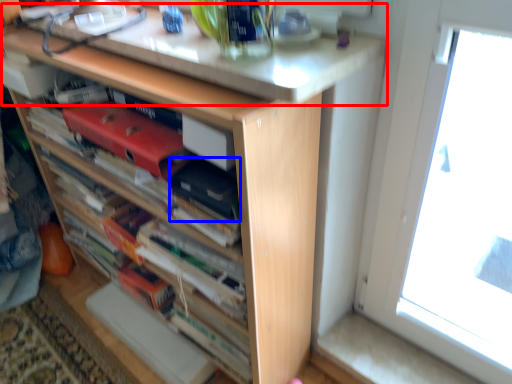
Question: Among these objects, which one is farthest to the camera, counter top (highlighted by a red box) or paperback book (highlighted by a blue box)?

Choices:
 (A) counter top
 (B) paperback book

Answer: (B)